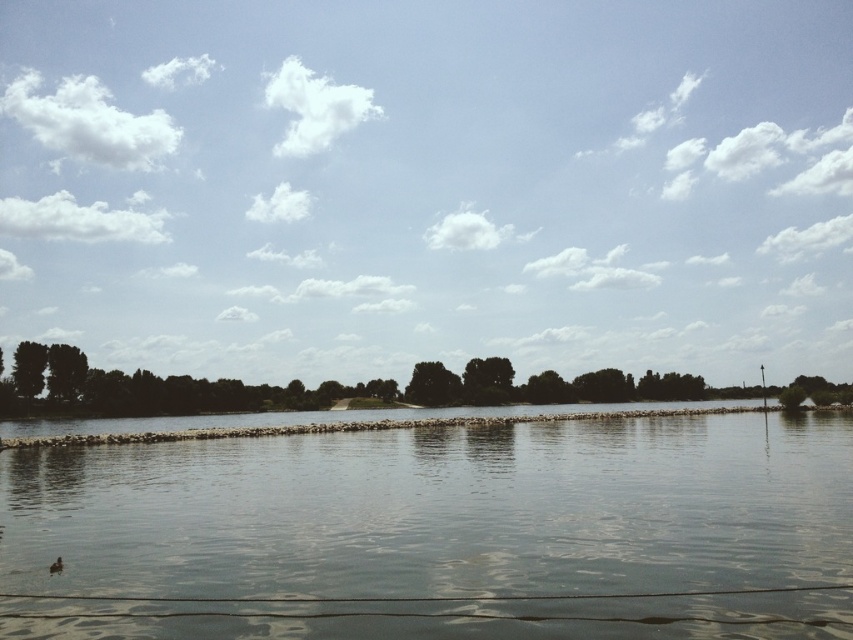
Question: Which of the following is the farthest from the observer?

Choices:
 (A) (57, 564)
 (B) (763, 476)

Answer: (B)

Question: Which point is farther to the camera?

Choices:
 (A) (546, 467)
 (B) (49, 572)

Answer: (A)

Question: Does gray stone river at center lie in front of brown fuzzy duck at lower left?

Choices:
 (A) no
 (B) yes

Answer: (B)

Question: Does gray stone river at center have a greater width compared to brown fuzzy duck at lower left?

Choices:
 (A) no
 (B) yes

Answer: (B)

Question: Among these points, which one is farthest from the camera?

Choices:
 (A) (57, 570)
 (B) (550, 636)

Answer: (A)

Question: Can you confirm if gray stone river at center is thinner than brown fuzzy duck at lower left?

Choices:
 (A) no
 (B) yes

Answer: (A)